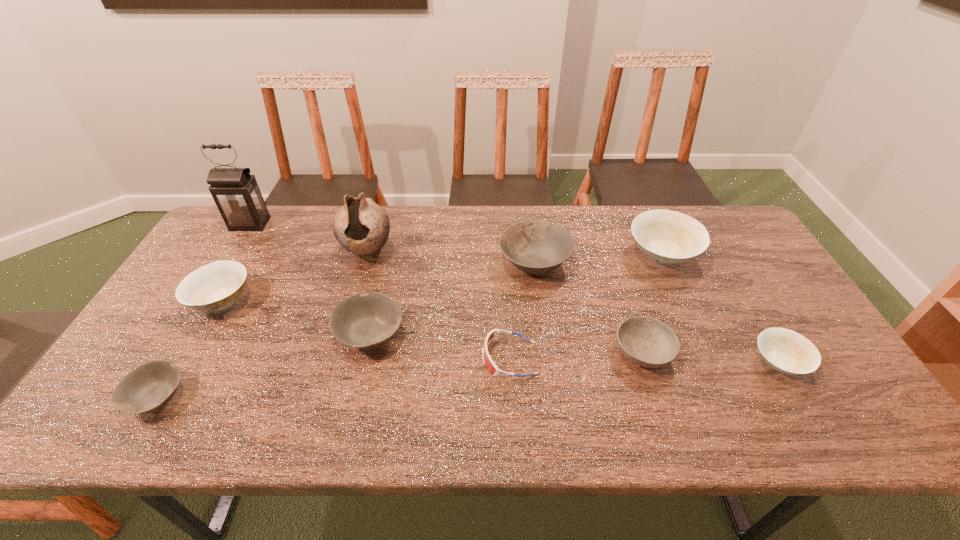
I want to click on blank area in the image that satisfies the following two spatial constraints: 1. from the spout of the second tallest object; 2. on the right side of the rightmost gray bowl, so click(x=365, y=262).

Find the location of a particular element. free space that satisfies the following two spatial constraints: 1. from the spout of the pottery; 2. on the right side of the fourth bowl from left to right is located at coordinates (365, 262).